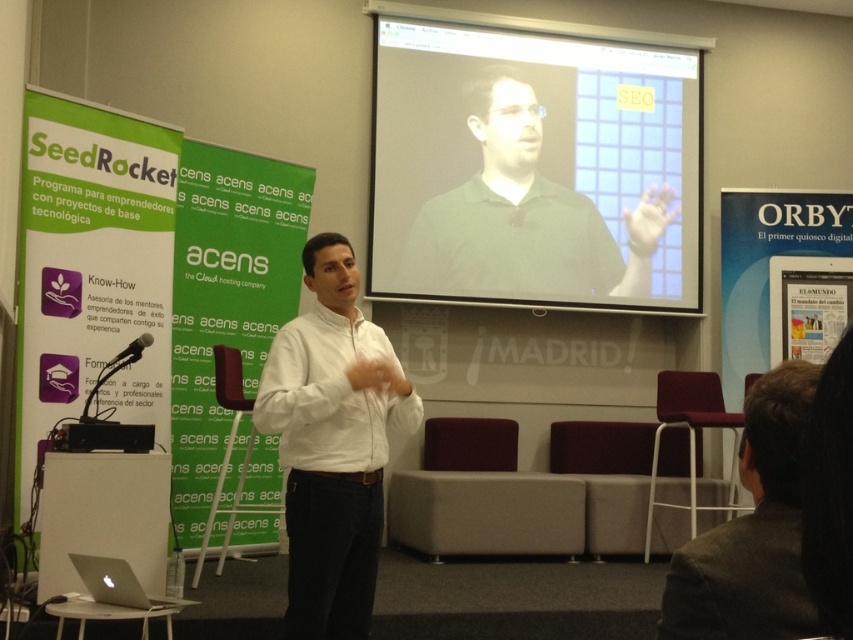
You are a photographer positioned in the conference room. You need to capture a photo of the white matte shirt at center and dark brown hair at lower right. The camera you are using has a minimum focus distance of 5 feet. Will both subjects be in focus?

The white matte shirt at center is 5.03 feet away from dark brown hair at lower right. Since the minimum focus distance is 5 feet, the camera can focus on both subjects as the distance between them is just over the required minimum.

You are attending a virtual meeting and see the dark brown hair at lower right and the silver metallic laptop at lower left on your screen. Which object appears taller in the image?

The dark brown hair at lower right appears taller than the silver metallic laptop at lower left in the image.